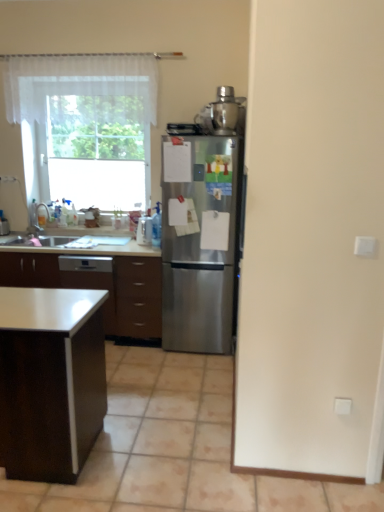
Where is `free space in front of clear plastic spray bottle at center, the 1th appliance in the back-to-front sequence`? This screenshot has width=384, height=512. free space in front of clear plastic spray bottle at center, the 1th appliance in the back-to-front sequence is located at coordinates (138, 247).